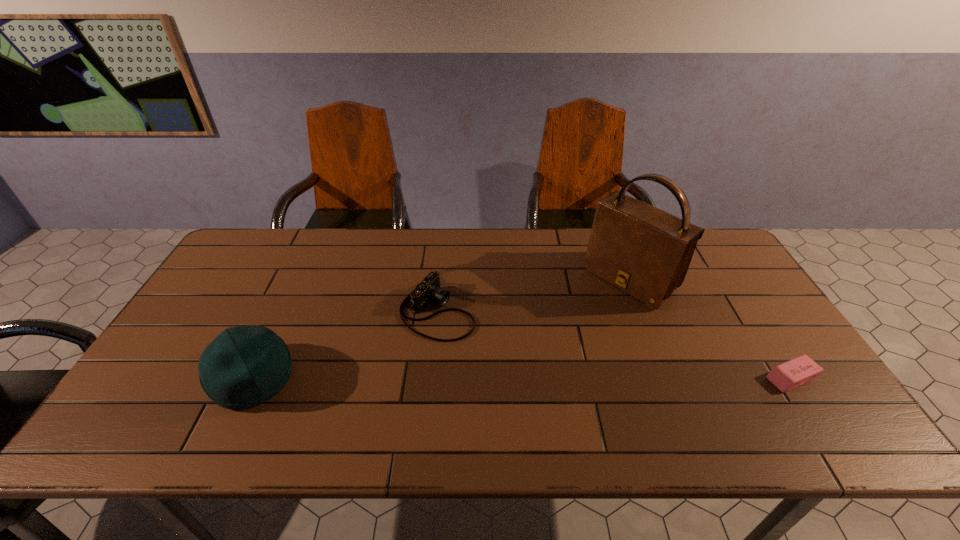
Identify the location of object that is at the right edge. This screenshot has height=540, width=960. (794, 373).

Where is `object present at the near left corner`? The image size is (960, 540). object present at the near left corner is located at coordinates (245, 366).

Locate an element on the screen. The height and width of the screenshot is (540, 960). object situated at the near right corner is located at coordinates [x=794, y=373].

The height and width of the screenshot is (540, 960). In the image, there is a desktop. In order to click on vacant space at the far edge in this screenshot , I will do `click(354, 263)`.

Where is `vacant position at the near edge of the desktop`? The width and height of the screenshot is (960, 540). vacant position at the near edge of the desktop is located at coordinates (403, 383).

The width and height of the screenshot is (960, 540). In the image, there is a desktop. In order to click on blank space at the left edge in this screenshot , I will do `click(202, 332)`.

Locate an element on the screen. Image resolution: width=960 pixels, height=540 pixels. vacant region at the far left corner of the desktop is located at coordinates (239, 262).

Find the location of a particular element. vacant space at the near right corner is located at coordinates (818, 394).

Locate an element on the screen. Image resolution: width=960 pixels, height=540 pixels. free spot between the camera and the rightmost object is located at coordinates (614, 345).

Find the location of a particular element. Image resolution: width=960 pixels, height=540 pixels. unoccupied area between the second shortest object and the leftmost object is located at coordinates (345, 345).